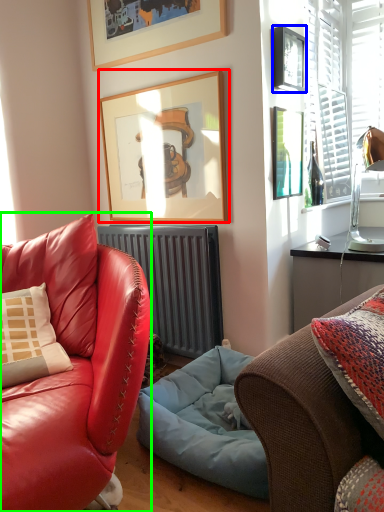
Question: Which object is positioned closest to picture frame (highlighted by a red box)? Select from picture frame (highlighted by a blue box) and studio couch (highlighted by a green box).

Choices:
 (A) picture frame
 (B) studio couch

Answer: (A)